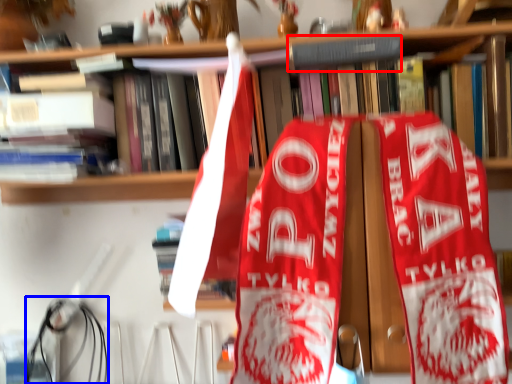
Question: Which object appears closest to the camera in this image, book (highlighted by a red box) or wire (highlighted by a blue box)?

Choices:
 (A) book
 (B) wire

Answer: (A)